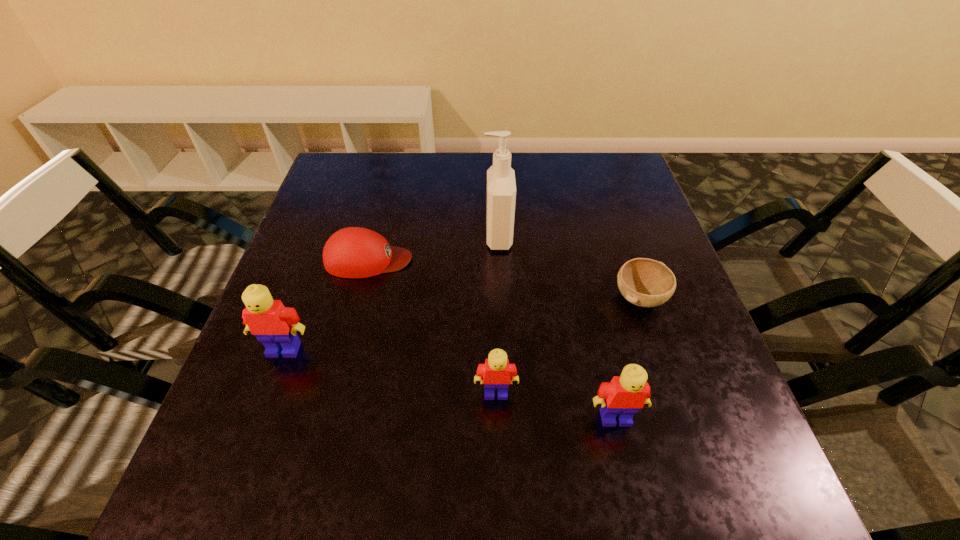
At what (x,y) coordinates should I click in order to perform the action: click on free space between the second nearest object and the second shortest object. Please return your answer as a coordinate pair (x, y). The width and height of the screenshot is (960, 540). Looking at the image, I should click on (432, 326).

Locate an element on the screen. This screenshot has width=960, height=540. free space that is in between the fifth farthest object and the tallest object is located at coordinates (496, 315).

The image size is (960, 540). Identify the location of free point between the fifth farthest object and the shortest object. (568, 346).

Locate an element on the screen. This screenshot has height=540, width=960. unoccupied position between the nearest Lego and the cleansing agent is located at coordinates (557, 327).

You are a GUI agent. You are given a task and a screenshot of the screen. Output one action in this format:
    pyautogui.click(x=<x>, y=<y>)
    Task: Click on the free point between the shortest object and the shortest Lego
    
    Given the screenshot: What is the action you would take?
    pyautogui.click(x=568, y=346)

Image resolution: width=960 pixels, height=540 pixels. What are the coordinates of `free space that is in between the second shortest object and the rightmost object` in the screenshot? It's located at (504, 279).

Identify which object is the fourth closest to the cleansing agent. Please provide its 2D coordinates. Your answer should be formatted as a tuple, i.e. [(x, y)], where the tuple contains the x and y coordinates of a point satisfying the conditions above.

[(626, 394)]

Identify which object is the third closest to the fourth tallest object. Please provide its 2D coordinates. Your answer should be formatted as a tuple, i.e. [(x, y)], where the tuple contains the x and y coordinates of a point satisfying the conditions above.

[(354, 252)]

Locate which Lego is the second closest to the cleansing agent. Please provide its 2D coordinates. Your answer should be formatted as a tuple, i.e. [(x, y)], where the tuple contains the x and y coordinates of a point satisfying the conditions above.

[(626, 394)]

Image resolution: width=960 pixels, height=540 pixels. In order to click on Lego that is the second nearest to the tallest object in this screenshot , I will do `click(626, 394)`.